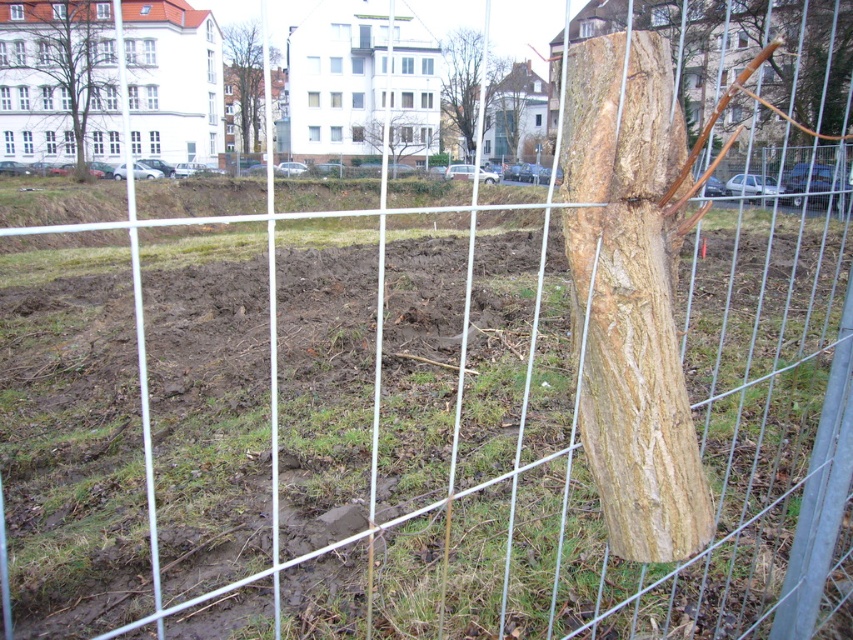
You are standing at the construction site and need to locate two specific points marked on a map. The first point is at coordinate point (12, 51) and the second is at point (463, 76). Based on the scene, which point is closer to you?

Point (12, 51) is in front of point (463, 76), so the first point is closer to you.

You are a delivery person trying to navigate through the construction site. You see the light brown wood at center and the brown rough tree at upper left. Which object is closer to the ground?

The light brown wood at center is positioned under the brown rough tree at upper left, so the light brown wood at center is closer to the ground.

In the scene shown: You are a city planner assessing the site. You see the light brown wood at center and the brown rough tree at upper center. Which object is shorter?

The light brown wood at center is shorter than the brown rough tree at upper center.